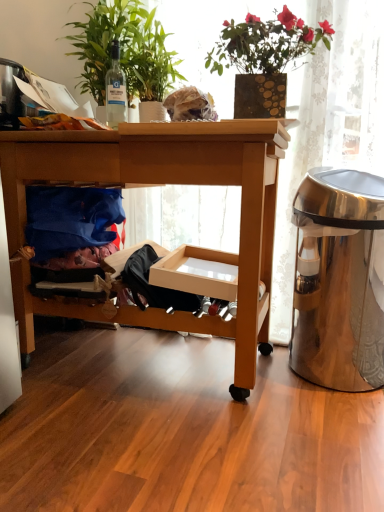
Question: Does clear glass bottle at upper left have a larger size compared to blue fabric at lower left?

Choices:
 (A) yes
 (B) no

Answer: (B)

Question: Is clear glass bottle at upper left taller than blue fabric at lower left?

Choices:
 (A) no
 (B) yes

Answer: (B)

Question: Does clear glass bottle at upper left turn towards blue fabric at lower left?

Choices:
 (A) yes
 (B) no

Answer: (B)

Question: Can you confirm if clear glass bottle at upper left is smaller than blue fabric at lower left?

Choices:
 (A) no
 (B) yes

Answer: (B)

Question: Is clear glass bottle at upper left outside blue fabric at lower left?

Choices:
 (A) yes
 (B) no

Answer: (A)

Question: Considering the positions of satin silver trash can at right and green glossy plant at upper left, which ranks as the 2th houseplant in right-to-left order, in the image, is satin silver trash can at right taller or shorter than green glossy plant at upper left, which ranks as the 2th houseplant in right-to-left order,?

Choices:
 (A) tall
 (B) short

Answer: (A)

Question: Looking at their shapes, would you say satin silver trash can at right is wider or thinner than green glossy plant at upper left, the first houseplant from the left?

Choices:
 (A) thin
 (B) wide

Answer: (A)

Question: From the image's perspective, is satin silver trash can at right positioned above or below green glossy plant at upper left, the first houseplant from the left?

Choices:
 (A) below
 (B) above

Answer: (A)

Question: From a real-world perspective, relative to green glossy plant at upper left, which ranks as the 2th houseplant in right-to-left order, is satin silver trash can at right vertically above or below?

Choices:
 (A) below
 (B) above

Answer: (A)

Question: Considering the positions of wooden desk at center and clear glass bottle at upper left in the image, is wooden desk at center taller or shorter than clear glass bottle at upper left?

Choices:
 (A) short
 (B) tall

Answer: (B)

Question: Considering the positions of point (23, 359) and point (117, 88), is point (23, 359) closer or farther from the camera than point (117, 88)?

Choices:
 (A) farther
 (B) closer

Answer: (B)

Question: In terms of size, does wooden desk at center appear bigger or smaller than clear glass bottle at upper left?

Choices:
 (A) small
 (B) big

Answer: (B)

Question: Would you say wooden desk at center is to the left or to the right of clear glass bottle at upper left in the picture?

Choices:
 (A) left
 (B) right

Answer: (B)

Question: Is green glossy plant at upper left, which ranks as the 2th houseplant in right-to-left order, spatially inside satin silver trash can at right, or outside of it?

Choices:
 (A) inside
 (B) outside

Answer: (B)

Question: Relative to satin silver trash can at right, is green glossy plant at upper left, the first houseplant from the left, in front or behind?

Choices:
 (A) behind
 (B) front

Answer: (A)